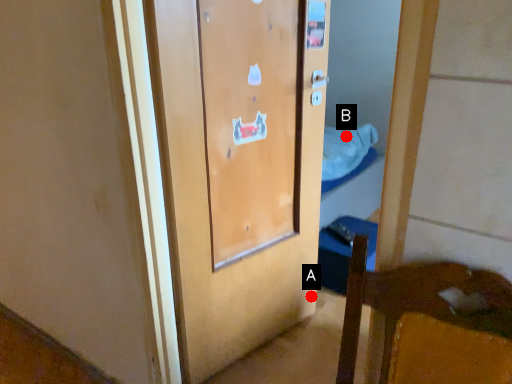
Question: Two points are circled on the image, labeled by A and B beside each circle. Which point is closer to the camera?

Choices:
 (A) A is closer
 (B) B is closer

Answer: (A)